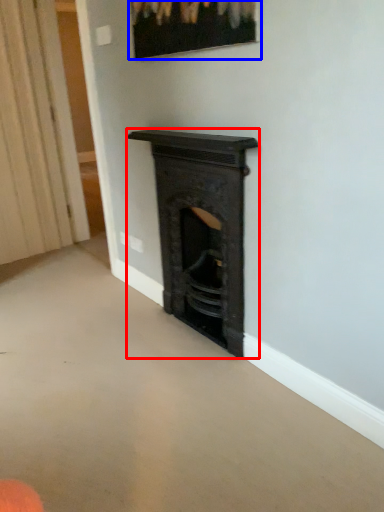
Question: Which point is further to the camera, fireplace (highlighted by a red box) or picture frame (highlighted by a blue box)?

Choices:
 (A) fireplace
 (B) picture frame

Answer: (A)